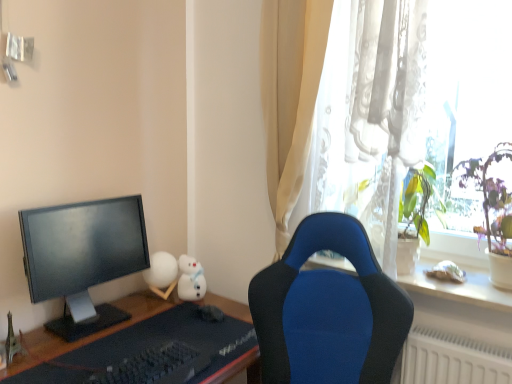
What are the coordinates of `vacant space that's between black matte desk at lower left and white matte sphere at center-left, placed as the 3th toy when sorted from right to left` in the screenshot? It's located at (114, 319).